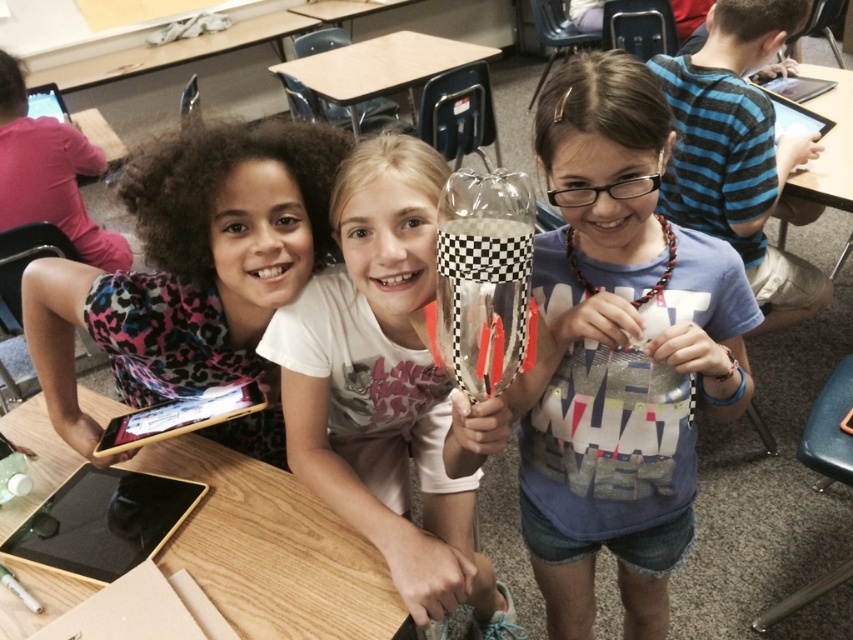
You are a photographer standing in the classroom and want to capture a photo of the blue striped shirt at right and the wooden table at right. Which object is positioned higher in the frame?

The blue striped shirt at right is much taller than the wooden table at right, so it is positioned higher in the frame.

You are a teacher observing the classroom scene. You notice the clear plastic cup at center and the wooden table at lower left. Which object is directly above the other?

The clear plastic cup at center is positioned over wooden table at lower left, meaning it is directly above the table.

You are standing in the classroom and want to find the blue striped shirt at right. According to the coordinates provided, where should you look to find it?

The blue striped shirt at right is located at the coordinates point (740, 152).